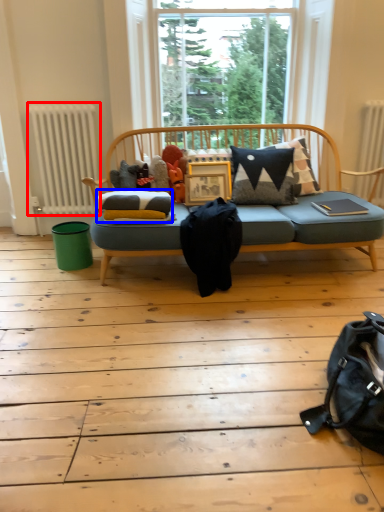
Question: Which object appears closest to the camera in this image, radiator (highlighted by a red box) or mattress (highlighted by a blue box)?

Choices:
 (A) radiator
 (B) mattress

Answer: (B)